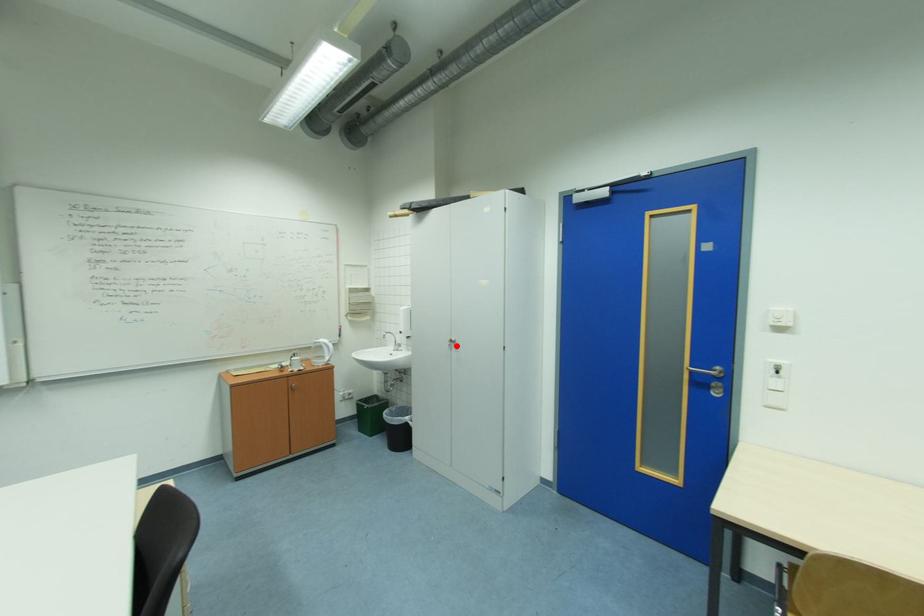
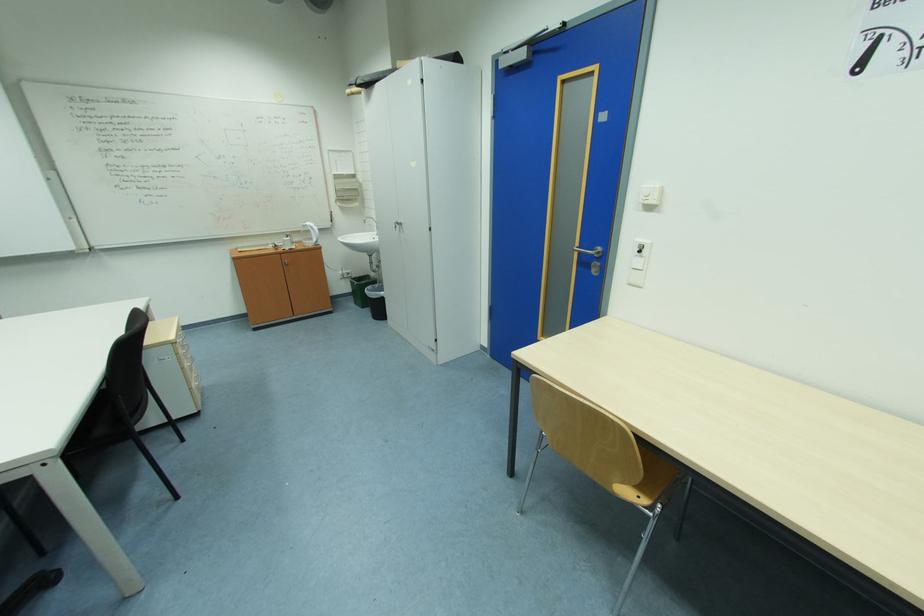
The point at the highlighted location is marked in the first image. Where is the corresponding point in the second image?

(403, 228)